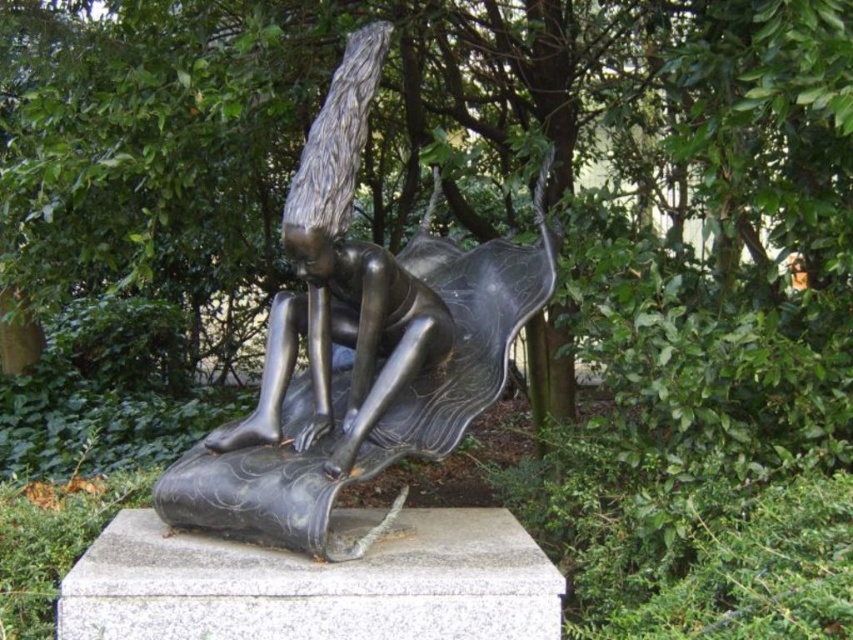
You are an art student analyzing the composition of the sculpture. The point marked at coordinates (358, 346) is part of the polished bronze statue at center. What does this point represent in terms of the statue?

The point at coordinates (358, 346) represents the center of the polished bronze statue at center.

Based on the provided scene description, where exactly is the polished bronze statue at center located in terms of coordinates?

The polished bronze statue at center is located at coordinates point [358,346].

Based on the scene description, which object is closer to the viewer between the polished bronze statue at center and the shiny bronze figure at center?

The polished bronze statue at center is closer to the viewer than the shiny bronze figure at center.